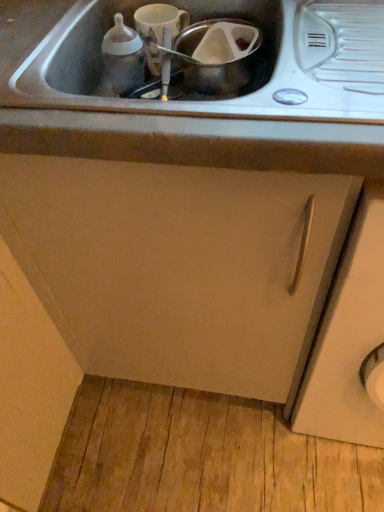
Identify the location of matte plastic bottle at upper left. The height and width of the screenshot is (512, 384). (123, 57).

Measure the distance between white matte cabinet door at center-right, the 1th cabinetry positioned from the right, and camera.

The distance of white matte cabinet door at center-right, the 1th cabinetry positioned from the right, from camera is 20.14 inches.

What do you see at coordinates (158, 30) in the screenshot? I see `matte white cup at upper center, the first appliance when ordered from left to right` at bounding box center [158, 30].

Measure the distance between matte white cup at upper center, the first appliance when ordered from left to right, and camera.

The distance of matte white cup at upper center, the first appliance when ordered from left to right, from camera is 30.85 inches.

I want to click on stainless steel sink at upper center, which ranks as the second sink in back-to-front order, so click(159, 117).

Describe the element at coordinates (159, 117) in the screenshot. This screenshot has height=512, width=384. I see `stainless steel sink at upper center, which ranks as the second sink in back-to-front order` at that location.

Image resolution: width=384 pixels, height=512 pixels. What do you see at coordinates (233, 61) in the screenshot?
I see `metallic stainless steel sink at center, the second sink positioned from the front` at bounding box center [233, 61].

I want to click on metallic stainless steel sink at center, the second sink positioned from the front, so click(233, 61).

How much space does transparent plastic container at center, which appears as the second appliance when viewed from the left, occupy horizontally?

The width of transparent plastic container at center, which appears as the second appliance when viewed from the left, is 5.02 inches.

I want to click on matte plastic bottle at upper left, so click(x=123, y=57).

From the image's perspective, relative to matte white cup at upper center, the first appliance when ordered from left to right, is matte white cabinet at center, which ranks as the second cabinetry in right-to-left order, above or below?

From the image's perspective, matte white cabinet at center, which ranks as the second cabinetry in right-to-left order, appears below matte white cup at upper center, the first appliance when ordered from left to right.

Does matte white cabinet at center, which ranks as the first cabinetry in left-to-right order, have a smaller size compared to matte white cup at upper center, marked as the second appliance in a right-to-left arrangement?

No, matte white cabinet at center, which ranks as the first cabinetry in left-to-right order, is not smaller than matte white cup at upper center, marked as the second appliance in a right-to-left arrangement.

Is matte white cabinet at center, which ranks as the first cabinetry in left-to-right order, positioned beyond the bounds of matte white cup at upper center, the first appliance when ordered from left to right?

Yes, matte white cabinet at center, which ranks as the first cabinetry in left-to-right order, is outside of matte white cup at upper center, the first appliance when ordered from left to right.

Does matte white cabinet at center, which ranks as the second cabinetry in right-to-left order, have a greater height compared to matte white cup at upper center, the first appliance when ordered from left to right?

Yes, matte white cabinet at center, which ranks as the second cabinetry in right-to-left order, is taller than matte white cup at upper center, the first appliance when ordered from left to right.

From the image's perspective, is matte plastic bottle at upper left located above metallic stainless steel sink at center, the second sink positioned from the front?

Yes, from the image's perspective, matte plastic bottle at upper left is on top of metallic stainless steel sink at center, the second sink positioned from the front.

From a real-world perspective, is matte plastic bottle at upper left positioned over metallic stainless steel sink at center, the second sink positioned from the front, based on gravity?

Yes, from a real-world perspective, matte plastic bottle at upper left is above metallic stainless steel sink at center, the second sink positioned from the front.

Does matte plastic bottle at upper left have a greater height compared to metallic stainless steel sink at center, the second sink positioned from the front?

Indeed, matte plastic bottle at upper left has a greater height compared to metallic stainless steel sink at center, the second sink positioned from the front.

From the image's perspective, is matte white cup at upper center, marked as the second appliance in a right-to-left arrangement, beneath transparent plastic container at center, the 1th appliance in the right-to-left sequence?

No, from the image's perspective, matte white cup at upper center, marked as the second appliance in a right-to-left arrangement, is not beneath transparent plastic container at center, the 1th appliance in the right-to-left sequence.

Which of these two, matte white cup at upper center, the first appliance when ordered from left to right, or transparent plastic container at center, which appears as the second appliance when viewed from the left, is wider?

Wider between the two is transparent plastic container at center, which appears as the second appliance when viewed from the left.

Is matte white cup at upper center, marked as the second appliance in a right-to-left arrangement, completely or partially outside of transparent plastic container at center, which appears as the second appliance when viewed from the left?

Yes, matte white cup at upper center, marked as the second appliance in a right-to-left arrangement, is not within transparent plastic container at center, which appears as the second appliance when viewed from the left.

Is matte white cup at upper center, the first appliance when ordered from left to right, taller or shorter than transparent plastic container at center, the 1th appliance in the right-to-left sequence?

matte white cup at upper center, the first appliance when ordered from left to right, is taller than transparent plastic container at center, the 1th appliance in the right-to-left sequence.

Measure the distance from matte white cabinet at center, which ranks as the second cabinetry in right-to-left order, to metallic stainless steel sink at center, the first sink when ordered from back to front.

matte white cabinet at center, which ranks as the second cabinetry in right-to-left order, and metallic stainless steel sink at center, the first sink when ordered from back to front, are 14.08 inches apart.

From the image's perspective, does matte white cabinet at center, which ranks as the second cabinetry in right-to-left order, appear lower than metallic stainless steel sink at center, the second sink positioned from the front?

Indeed, from the image's perspective, matte white cabinet at center, which ranks as the second cabinetry in right-to-left order, is shown beneath metallic stainless steel sink at center, the second sink positioned from the front.

From a real-world perspective, is matte white cabinet at center, which ranks as the first cabinetry in left-to-right order, positioned under metallic stainless steel sink at center, the second sink positioned from the front, based on gravity?

Correct, in the physical world, matte white cabinet at center, which ranks as the first cabinetry in left-to-right order, is lower than metallic stainless steel sink at center, the second sink positioned from the front.

Can stainless steel sink at upper center, which ranks as the second sink in back-to-front order, be found inside matte white cabinet at center, which ranks as the second cabinetry in right-to-left order?

Yes, stainless steel sink at upper center, which ranks as the second sink in back-to-front order, is inside matte white cabinet at center, which ranks as the second cabinetry in right-to-left order.

Does point (79, 280) come in front of point (268, 157)?

That is False.

Considering the sizes of objects matte white cabinet at center, which ranks as the first cabinetry in left-to-right order, and stainless steel sink at upper center, the 1th sink viewed from the front, in the image provided, who is smaller, matte white cabinet at center, which ranks as the first cabinetry in left-to-right order, or stainless steel sink at upper center, the 1th sink viewed from the front,?

stainless steel sink at upper center, the 1th sink viewed from the front, is smaller.

From the image's perspective, count 1st sinks upward from the matte white cabinet at center, which ranks as the second cabinetry in right-to-left order, and point to it. Please provide its 2D coordinates.

[(159, 117)]

Which is in front, point (267, 78) or point (151, 40)?

The point (151, 40) is closer to the camera.

Is metallic stainless steel sink at center, the second sink positioned from the front, positioned with its back to matte white cup at upper center, the first appliance when ordered from left to right?

That's not correct — metallic stainless steel sink at center, the second sink positioned from the front, is not looking away from matte white cup at upper center, the first appliance when ordered from left to right.

In order to click on the 2nd sink counting from the right side of the matte white cup at upper center, the first appliance when ordered from left to right in this screenshot , I will do `click(233, 61)`.

Who is smaller, white matte cabinet door at center-right, the 1th cabinetry positioned from the right, or matte white cabinet at center, which ranks as the second cabinetry in right-to-left order?

Smaller between the two is white matte cabinet door at center-right, the 1th cabinetry positioned from the right.

From a real-world perspective, is white matte cabinet door at center-right, the 1th cabinetry positioned from the right, below matte white cabinet at center, which ranks as the second cabinetry in right-to-left order?

Yes.

Based on the photo, which object is positioned more to the right, white matte cabinet door at center-right, the 1th cabinetry positioned from the right, or matte white cabinet at center, which ranks as the second cabinetry in right-to-left order?

From the viewer's perspective, white matte cabinet door at center-right, the 1th cabinetry positioned from the right, appears more on the right side.

Who is taller, white matte cabinet door at center-right, the 1th cabinetry positioned from the right, or matte white cabinet at center, which ranks as the second cabinetry in right-to-left order?

white matte cabinet door at center-right, the 1th cabinetry positioned from the right, is taller.

Identify the location of the 1st cabinetry in front of the matte white cup at upper center, the first appliance when ordered from left to right. The width and height of the screenshot is (384, 512). (179, 266).

From a real-world perspective, which sink is the 2nd one underneath the matte plastic bottle at upper left? Please provide its 2D coordinates.

[(233, 61)]

Considering their positions, is stainless steel sink at upper center, which ranks as the second sink in back-to-front order, positioned closer to metallic stainless steel sink at center, the first sink when ordered from back to front, than white matte cabinet door at center-right, the 2th cabinetry when ordered from left to right?

The object closer to metallic stainless steel sink at center, the first sink when ordered from back to front, is stainless steel sink at upper center, which ranks as the second sink in back-to-front order.

Looking at the image, which one is located closer to matte white cup at upper center, the first appliance when ordered from left to right, matte plastic bottle at upper left or metallic stainless steel sink at center, the first sink when ordered from back to front?

matte plastic bottle at upper left is closer to matte white cup at upper center, the first appliance when ordered from left to right.

Looking at the image, which one is located further to matte white cup at upper center, the first appliance when ordered from left to right, transparent plastic container at center, which appears as the second appliance when viewed from the left, or white matte cabinet door at center-right, the 2th cabinetry when ordered from left to right?

Based on the image, white matte cabinet door at center-right, the 2th cabinetry when ordered from left to right, appears to be further to matte white cup at upper center, the first appliance when ordered from left to right.

When comparing their distances from matte white cup at upper center, the first appliance when ordered from left to right, does stainless steel sink at upper center, which ranks as the second sink in back-to-front order, or matte white cabinet at center, which ranks as the second cabinetry in right-to-left order, seem closer?

Based on the image, stainless steel sink at upper center, which ranks as the second sink in back-to-front order, appears to be nearer to matte white cup at upper center, the first appliance when ordered from left to right.

Which object lies nearer to the anchor point matte white cup at upper center, marked as the second appliance in a right-to-left arrangement, metallic stainless steel sink at center, the first sink when ordered from back to front, or matte white cabinet at center, which ranks as the first cabinetry in left-to-right order?

The object closer to matte white cup at upper center, marked as the second appliance in a right-to-left arrangement, is metallic stainless steel sink at center, the first sink when ordered from back to front.

Which object lies nearer to the anchor point matte plastic bottle at upper left, metallic stainless steel sink at center, the second sink positioned from the front, or transparent plastic container at center, which appears as the second appliance when viewed from the left?

Among the two, metallic stainless steel sink at center, the second sink positioned from the front, is located nearer to matte plastic bottle at upper left.

Based on their spatial positions, is matte plastic bottle at upper left or metallic stainless steel sink at center, the second sink positioned from the front, further from matte white cabinet at center, which ranks as the second cabinetry in right-to-left order?

Among the two, matte plastic bottle at upper left is located further to matte white cabinet at center, which ranks as the second cabinetry in right-to-left order.

Estimate the real-world distances between objects in this image. Which object is further from metallic stainless steel sink at center, the first sink when ordered from back to front, matte white cup at upper center, marked as the second appliance in a right-to-left arrangement, or matte white cabinet at center, which ranks as the second cabinetry in right-to-left order?

Among the two, matte white cabinet at center, which ranks as the second cabinetry in right-to-left order, is located further to metallic stainless steel sink at center, the first sink when ordered from back to front.

You are a GUI agent. You are given a task and a screenshot of the screen. Output one action in this format:
    pyautogui.click(x=<x>, y=<y>)
    Task: Click on the sink positioned between stainless steel sink at upper center, which ranks as the second sink in back-to-front order, and matte white cup at upper center, the first appliance when ordered from left to right, from near to far
    This screenshot has height=512, width=384.
    Given the screenshot: What is the action you would take?
    pyautogui.click(x=233, y=61)

I want to click on appliance between stainless steel sink at upper center, which ranks as the second sink in back-to-front order, and white matte cabinet door at center-right, the 2th cabinetry when ordered from left to right, so click(216, 55).

Locate an element on the screen. bottle between stainless steel sink at upper center, which ranks as the second sink in back-to-front order, and matte white cup at upper center, the first appliance when ordered from left to right, from front to back is located at coordinates (123, 57).

I want to click on appliance between stainless steel sink at upper center, which ranks as the second sink in back-to-front order, and matte white cup at upper center, the first appliance when ordered from left to right, along the z-axis, so click(216, 55).